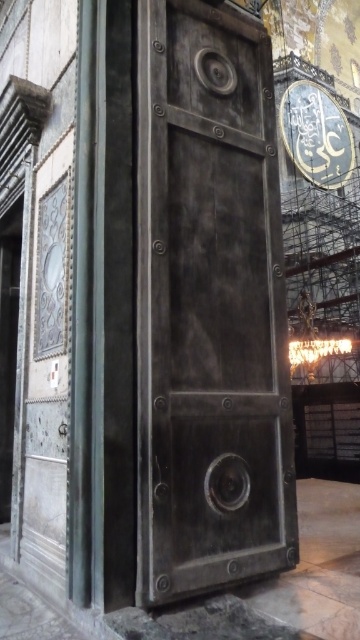
You are standing in the interior space and want to move from the point at coordinates (279, 564) to the point at (317, 100). Given that both points are on the floor, which direction should you walk to reach the second point?

You should walk towards the left because point (279, 564) is in front of point (317, 100), meaning the second point is to the left side relative to your starting position.

You are an interior designer planning to install a new lighting fixture. You see the rusty metal door at center and the shiny metallic clock at center. Which object should you consider moving first to ensure the lighting fixture can be placed behind both?

The rusty metal door at center is in front of the shiny metallic clock at center, so you should move the rusty metal door at center first to access the area behind both objects.